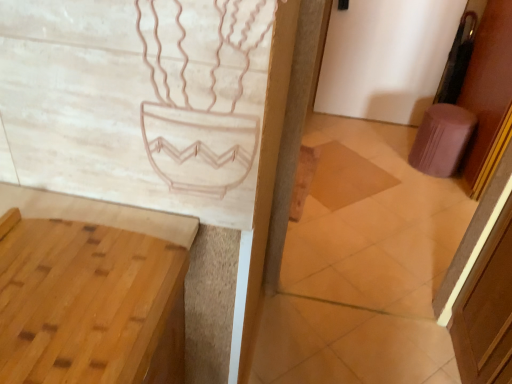
Locate an element on the screen. The width and height of the screenshot is (512, 384). free space to the left of pink fabric stool at right is located at coordinates (388, 163).